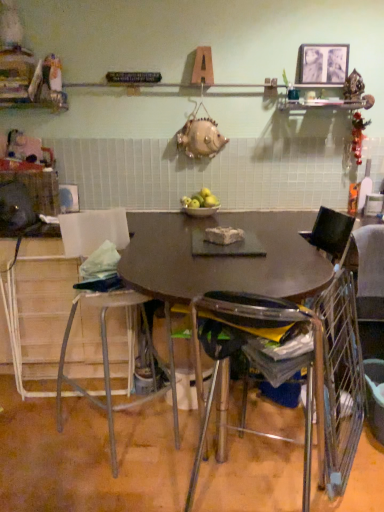
Find the location of a particular element. This screenshot has height=512, width=384. free area in between matte brown table at center and metallic stool at lower left, the 3th chair from the right is located at coordinates (82, 474).